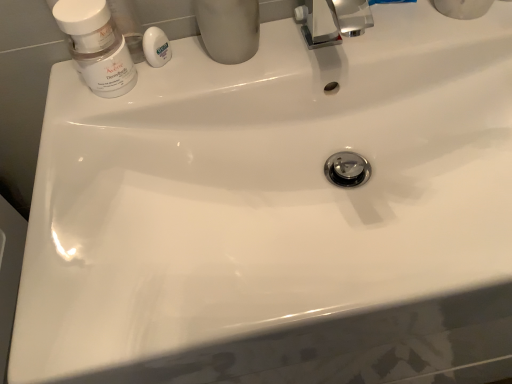
At what (x,y) coordinates should I click in order to perform the action: click on free space in front of white glossy soap at upper center. Please return your answer as a coordinate pair (x, y). This screenshot has width=512, height=384. Looking at the image, I should click on (114, 127).